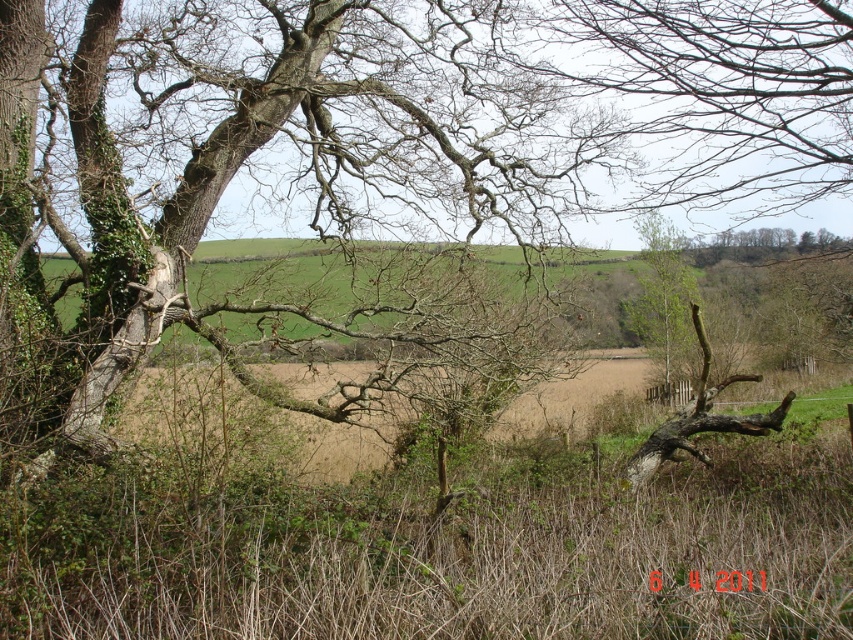
You are a painter setting up your easel in the field. You want to capture the two trees in your painting so that the smooth bark tree at left and the green leafy tree at center are both visible. Given their sizes, which tree should you place closer to the center of your painting to maintain balance?

The smooth bark tree at left is wider than the green leafy tree at center, so to balance the composition, you should place the smaller green leafy tree at center closer to the center of the painting.

You are standing in the rural landscape scene and want to find the smooth bark tree at left. Based on its 2D location coordinates, where should you look relative to the center of the image?

The smooth bark tree at left is located at coordinates point (247, 170), which is to the left and slightly below the center of the image.